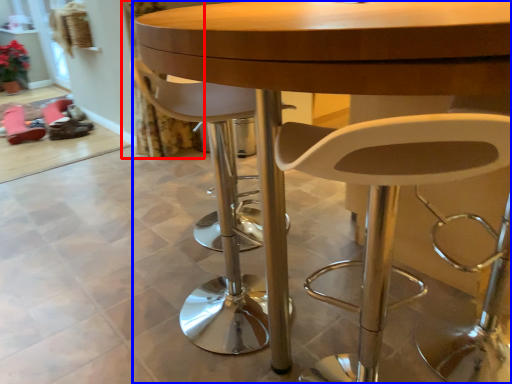
Question: Which point is further to the camera, curtain (highlighted by a red box) or table (highlighted by a blue box)?

Choices:
 (A) curtain
 (B) table

Answer: (A)